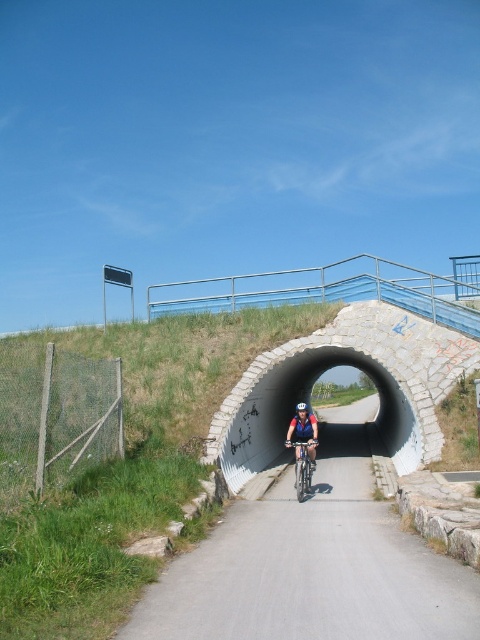
Is matte blue helmet at center shorter than shiny metallic bicycle at center?

No.

Is matte blue helmet at center positioned behind shiny metallic bicycle at center?

Yes, it is.

What do you see at coordinates (304, 433) in the screenshot? This screenshot has width=480, height=640. I see `matte blue helmet at center` at bounding box center [304, 433].

At what (x,y) coordinates should I click in order to perform the action: click on matte blue helmet at center. Please return your answer as a coordinate pair (x, y). This screenshot has height=640, width=480. Looking at the image, I should click on (304, 433).

Which is behind, point (302, 445) or point (299, 406)?

Positioned behind is point (302, 445).

Locate an element on the screen. This screenshot has height=640, width=480. shiny metallic bicycle at center is located at coordinates (302, 467).

I want to click on shiny metallic bicycle at center, so click(x=302, y=467).

Does matte blue helmet at center lie in front of white matte bicycle helmet at center?

No.

Measure the distance between point (291, 420) and camera.

They are 13.86 meters apart.

At what (x,y) coordinates should I click in order to perform the action: click on matte blue helmet at center. Please return your answer as a coordinate pair (x, y). Looking at the image, I should click on (304, 433).